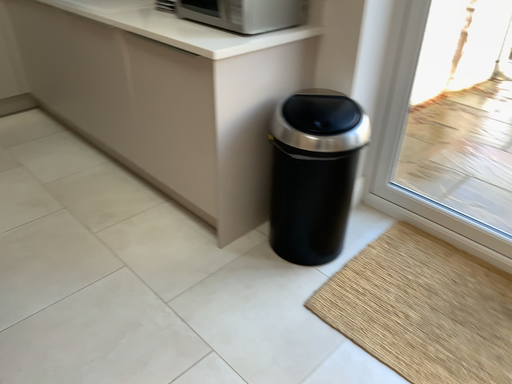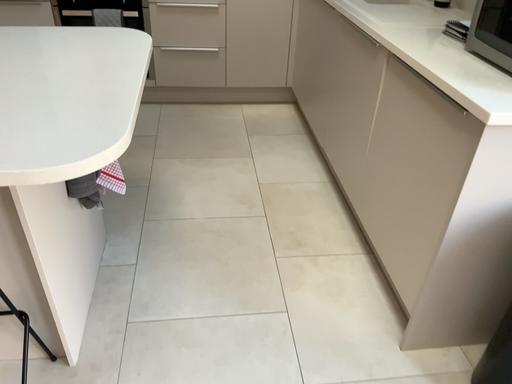
Question: How did the camera likely rotate when shooting the video?

Choices:
 (A) rotated downward
 (B) rotated upward

Answer: (B)